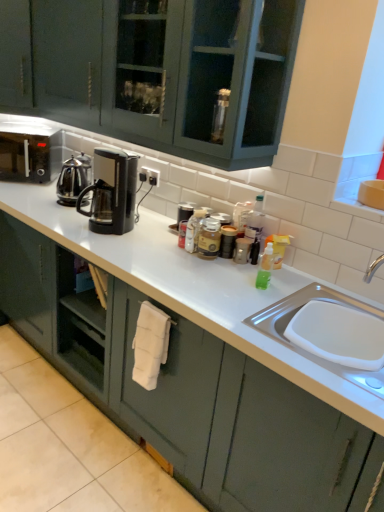
Locate an element on the screen. The width and height of the screenshot is (384, 512). free location in front of metallic silver canister at center, the first appliance positioned from the right is located at coordinates (246, 275).